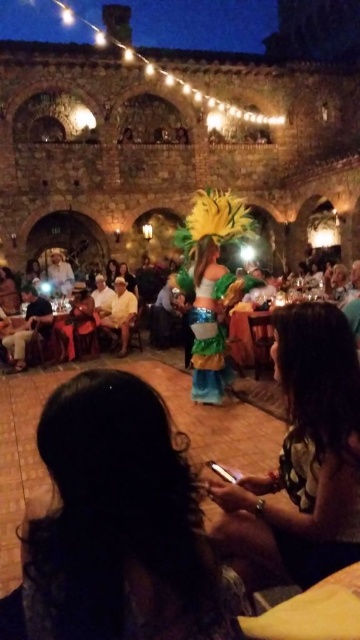
Question: Which object appears farthest from the camera in this image?

Choices:
 (A) shiny metallic phone at lower right
 (B) light brown leather jacket at lower left

Answer: (B)

Question: Which point is closer to the camera?

Choices:
 (A) pyautogui.click(x=236, y=317)
 (B) pyautogui.click(x=279, y=564)

Answer: (B)

Question: Does wooden table at center have a greater width compared to light brown leather jacket at lower left?

Choices:
 (A) no
 (B) yes

Answer: (B)

Question: Is shiny metallic phone at lower right above wooden table at center?

Choices:
 (A) no
 (B) yes

Answer: (A)

Question: Which of the following is the farthest from the observer?

Choices:
 (A) click(x=37, y=323)
 (B) click(x=324, y=509)

Answer: (A)

Question: Does wooden table at center have a lesser width compared to light brown leather jacket at lower left?

Choices:
 (A) yes
 (B) no

Answer: (B)